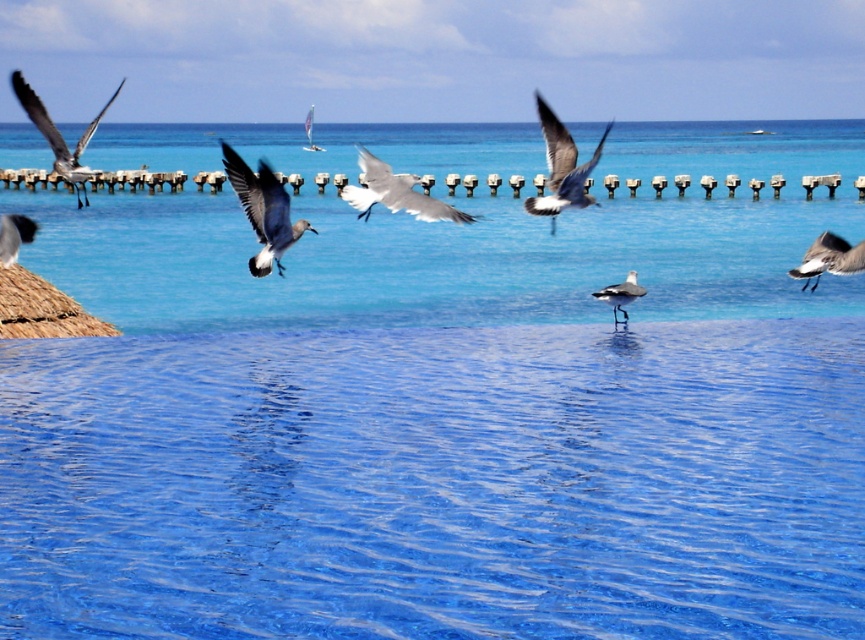
Can you confirm if gray matte seagull at upper left is thinner than white feathered seagull at right?

Incorrect, gray matte seagull at upper left's width is not less than white feathered seagull at right's.

Does gray matte seagull at upper left appear under white feathered seagull at right?

Actually, gray matte seagull at upper left is above white feathered seagull at right.

Identify the location of gray matte seagull at upper left. (59, 134).

Is gray matte seagull at upper center smaller than matte black bird at left?

Actually, gray matte seagull at upper center might be larger than matte black bird at left.

Who is taller, gray matte seagull at upper center or matte black bird at left?

gray matte seagull at upper center

This screenshot has height=640, width=865. I want to click on gray matte seagull at upper center, so click(561, 168).

Between gray matte seagull at upper center and white feathered seagull at right, which one is positioned lower?

white feathered seagull at right is below.

Between point (577, 188) and point (817, 253), which one is positioned behind?

Positioned behind is point (817, 253).

Is point (542, 122) positioned behind point (855, 264)?

No, it is not.

This screenshot has height=640, width=865. I want to click on gray matte seagull at upper center, so click(x=561, y=168).